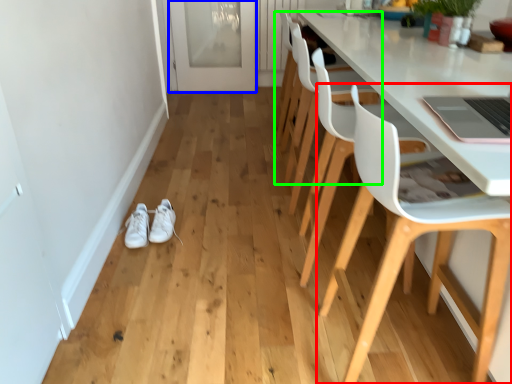
Question: Considering the real-world distances, which object is farthest from chair (highlighted by a red box)? glass door (highlighted by a blue box) or chair (highlighted by a green box)?

Choices:
 (A) glass door
 (B) chair

Answer: (A)